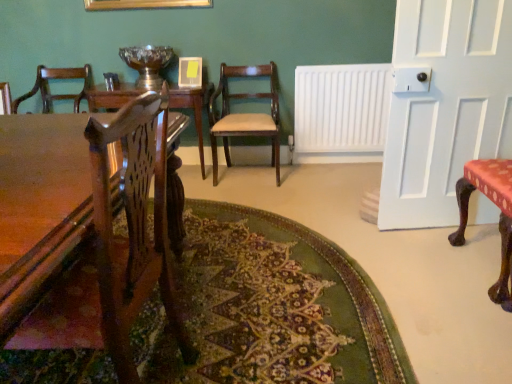
This screenshot has height=384, width=512. Identify the location of vacant space in between mahogany wood chair at center, which appears as the 2th chair when viewed from the right, and white plastic radiator at center. (312, 173).